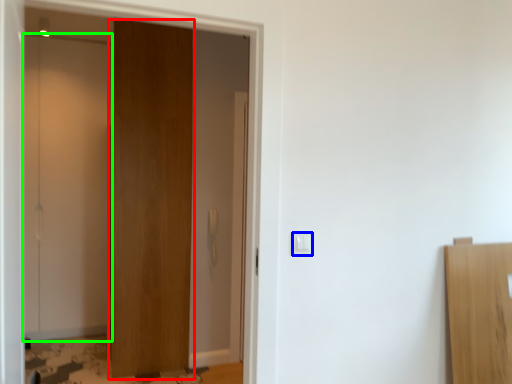
Question: Which object is the farthest from door (highlighted by a red box)? Choose among these: light switch (highlighted by a blue box) or door (highlighted by a green box).

Choices:
 (A) light switch
 (B) door

Answer: (A)